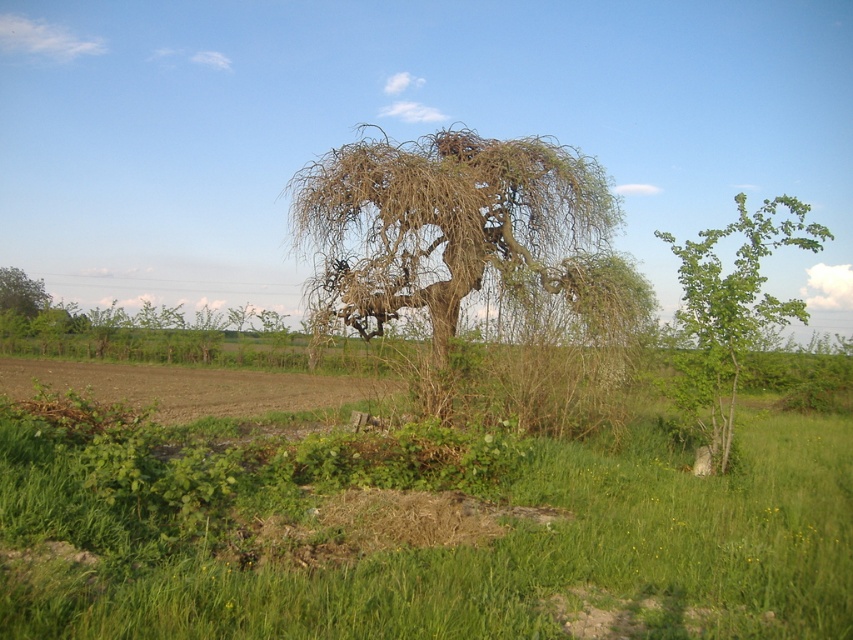
Question: Which point is farther to the camera?

Choices:
 (A) green leafy tree at left
 (B) green leafy tree at right
 (C) green grass at center

Answer: (A)

Question: Is bare branches at center positioned behind green leafy tree at right?

Choices:
 (A) no
 (B) yes

Answer: (B)

Question: Does bare branches at center appear over green leafy tree at left?

Choices:
 (A) no
 (B) yes

Answer: (B)

Question: Which object appears farthest from the camera in this image?

Choices:
 (A) green leafy tree at left
 (B) green grass at center

Answer: (A)

Question: Estimate the real-world distances between objects in this image. Which object is farther from the green leafy tree at left?

Choices:
 (A) green leafy tree at right
 (B) bare branches at center
 (C) green grass at center

Answer: (A)

Question: Is green grass at center above green leafy tree at right?

Choices:
 (A) no
 (B) yes

Answer: (A)